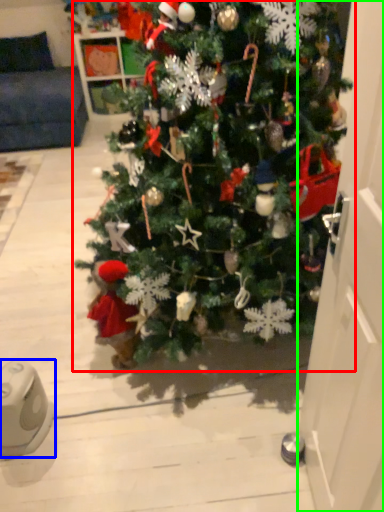
Question: Estimate the real-world distances between objects in this image. Which object is closer to christmas tree (highlighted by a red box), ipod (highlighted by a blue box) or door (highlighted by a green box)?

Choices:
 (A) ipod
 (B) door

Answer: (B)